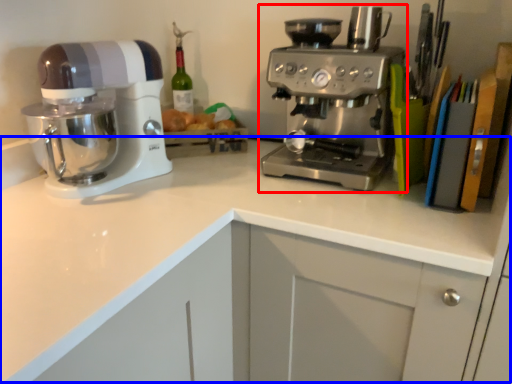
Question: Which of the following is the farthest to the observer, coffee maker (highlighted by a red box) or counter top (highlighted by a blue box)?

Choices:
 (A) coffee maker
 (B) counter top

Answer: (A)